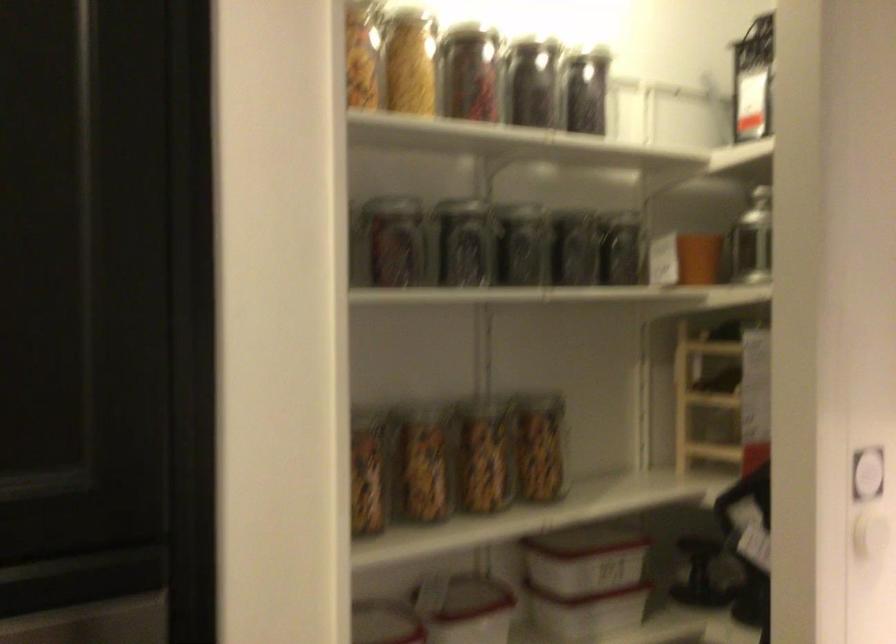
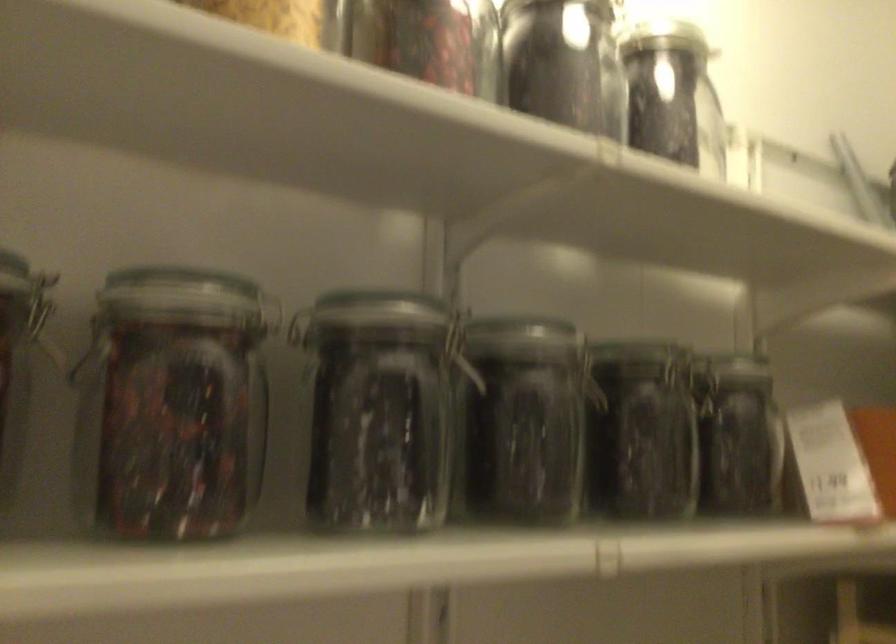
In the second image, find the point that corresponds to the point at 478,89 in the first image.

(426, 41)